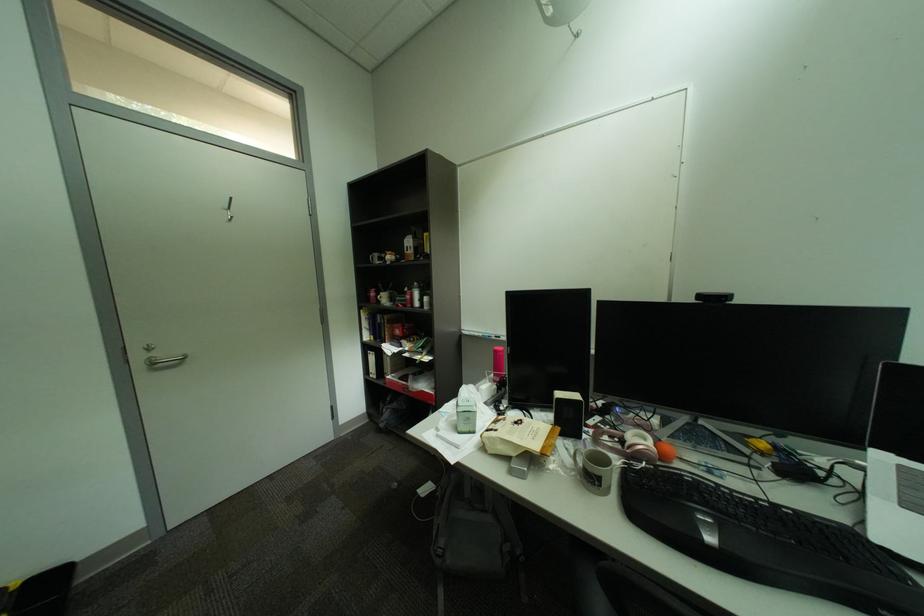
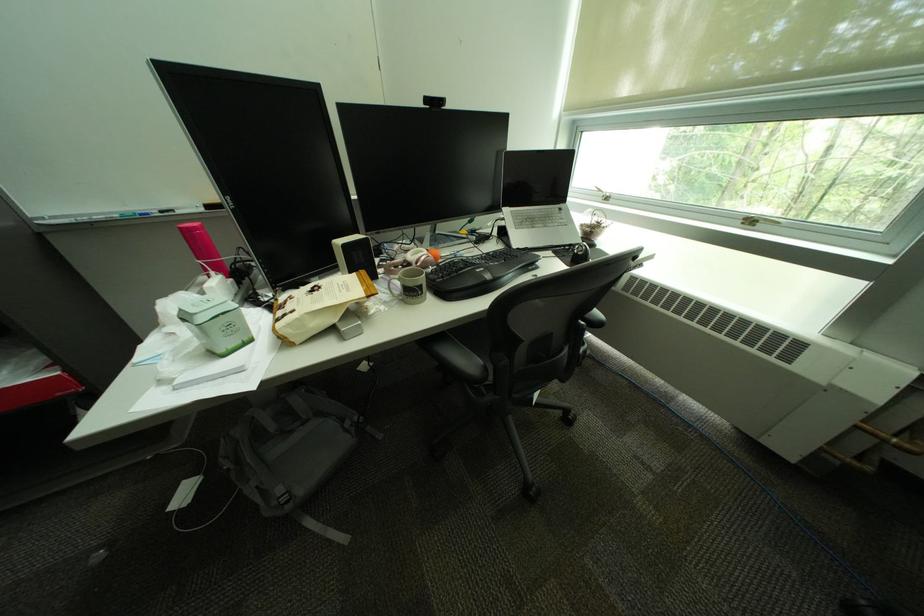
Find the pixel in the second image that matches the point at 505,351 in the first image.

(190, 230)